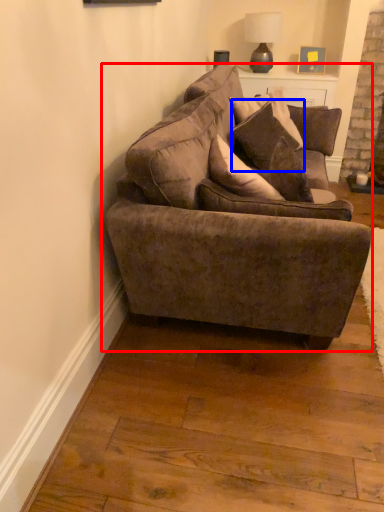
Question: Among these objects, which one is nearest to the camera, studio couch (highlighted by a red box) or pillow (highlighted by a blue box)?

Choices:
 (A) studio couch
 (B) pillow

Answer: (A)